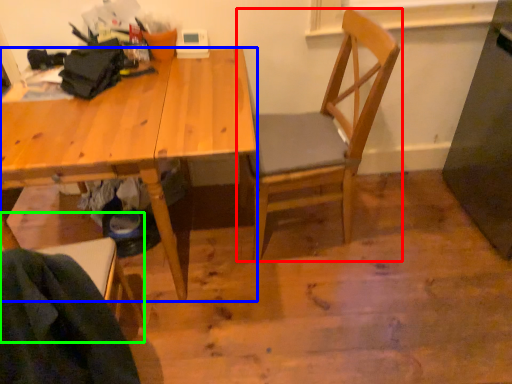
Question: Considering the real-world distances, which object is closest to chair (highlighted by a red box)? desk (highlighted by a blue box) or chair (highlighted by a green box).

Choices:
 (A) desk
 (B) chair

Answer: (A)